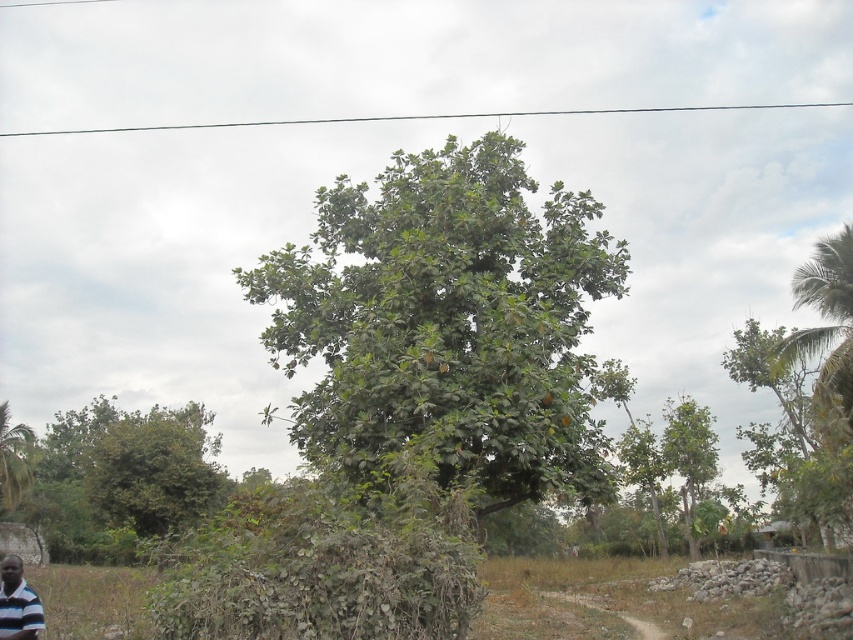
Is green leafy tree at center above green leafy tree at lower left?

Indeed, green leafy tree at center is positioned over green leafy tree at lower left.

Locate an element on the screen. The height and width of the screenshot is (640, 853). green leafy tree at center is located at coordinates (447, 323).

Is point (308, 337) closer to viewer compared to point (51, 468)?

Yes, point (308, 337) is closer to viewer.

Find the location of a particular element. green leafy tree at center is located at coordinates (447, 323).

Which of these two, green leafy tree at center or green leafy tree at right, stands taller?

green leafy tree at center

Does green leafy tree at center appear on the right side of green leafy tree at right?

In fact, green leafy tree at center is to the left of green leafy tree at right.

Is point (590, 493) farther from viewer compared to point (708, 433)?

No.

Where is `green leafy tree at center`? The image size is (853, 640). green leafy tree at center is located at coordinates (447, 323).

Is green leafy tree at right below striped polo shirt at lower left?

Yes, green leafy tree at right is below striped polo shirt at lower left.

Where is `green leafy tree at right`? green leafy tree at right is located at coordinates (689, 456).

At what (x,y) coordinates should I click in order to perform the action: click on green leafy tree at right. Please return your answer as a coordinate pair (x, y). This screenshot has height=640, width=853. Looking at the image, I should click on (689, 456).